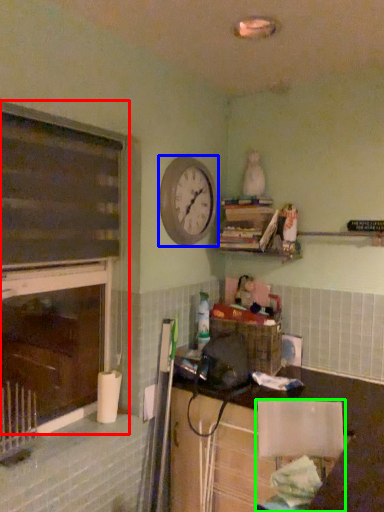
Question: Which is farther away from window frame (highlighted by a red box)? clock (highlighted by a blue box) or chair (highlighted by a green box)?

Choices:
 (A) clock
 (B) chair

Answer: (B)